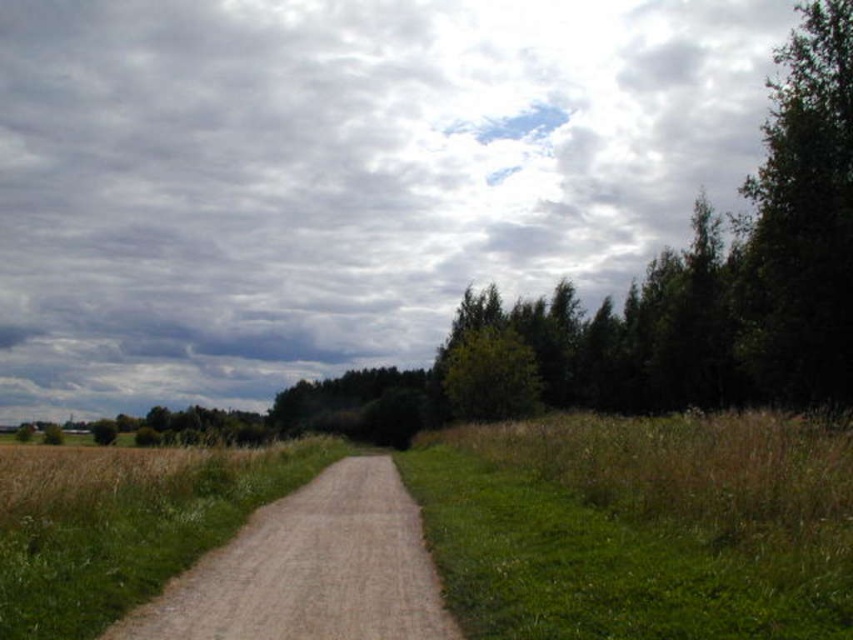
In the scene shown: You are standing at the starting point of the dirt path in the rural landscape. You need to locate the dusty gravel path at center. According to the coordinates provided, where should you look to find it?

The dusty gravel path at center is located at coordinates point [310,570].